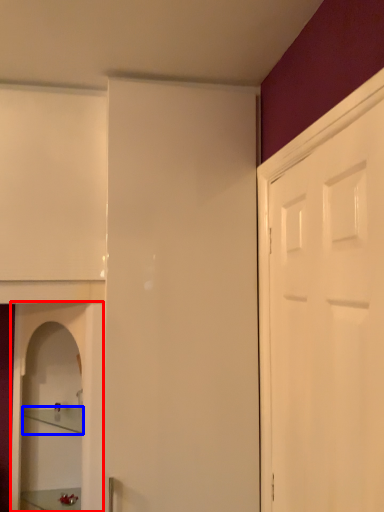
Question: Among these objects, which one is farthest to the camera, cabinetry (highlighted by a red box) or shelf (highlighted by a blue box)?

Choices:
 (A) cabinetry
 (B) shelf

Answer: (B)